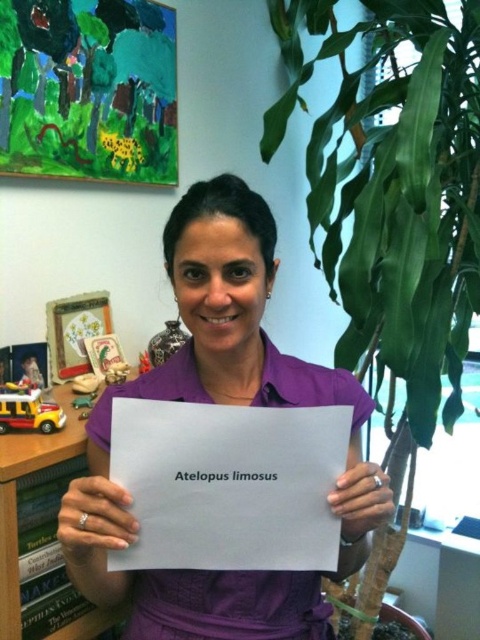
Can you confirm if purple fabric shirt at center is wider than white paper at center?

Indeed, purple fabric shirt at center has a greater width compared to white paper at center.

Does purple fabric shirt at center have a smaller size compared to white paper at center?

Actually, purple fabric shirt at center might be larger than white paper at center.

Find the location of a particular element. purple fabric shirt at center is located at coordinates (223, 403).

Image resolution: width=480 pixels, height=640 pixels. I want to click on purple fabric shirt at center, so [223, 403].

Does green leafy plant at center have a greater height compared to white paper at center?

Correct, green leafy plant at center is much taller as white paper at center.

Is green leafy plant at center above white paper at center?

Correct, green leafy plant at center is located above white paper at center.

Which is behind, point (359, 625) or point (152, 476)?

The point (359, 625) is behind.

Where is `green leafy plant at center`? The image size is (480, 640). green leafy plant at center is located at coordinates (395, 195).

In the scene shown: Which is below, green leafy plant at center or purple fabric shirt at center?

purple fabric shirt at center is below.

Between green leafy plant at center and purple fabric shirt at center, which one has more height?

green leafy plant at center

This screenshot has width=480, height=640. What do you see at coordinates (395, 195) in the screenshot? I see `green leafy plant at center` at bounding box center [395, 195].

At what (x,y) coordinates should I click in order to perform the action: click on green leafy plant at center. Please return your answer as a coordinate pair (x, y). Image resolution: width=480 pixels, height=640 pixels. Looking at the image, I should click on point(395,195).